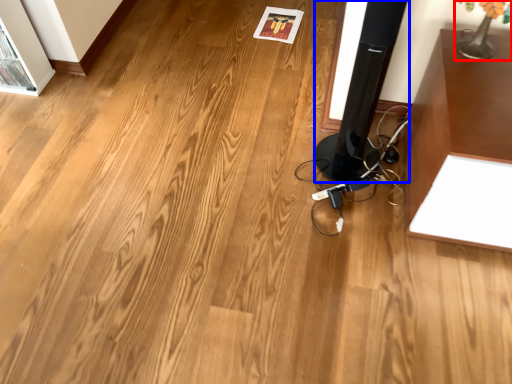
Question: Among these objects, which one is farthest to the camera, table lamp (highlighted by a red box) or speaker (highlighted by a blue box)?

Choices:
 (A) table lamp
 (B) speaker

Answer: (A)